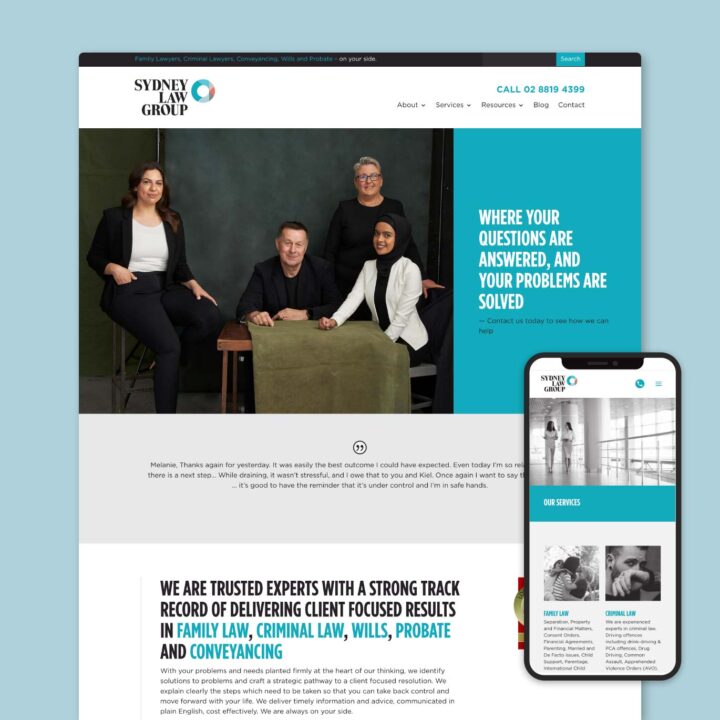
Locate an element on the screen. table is located at coordinates (235, 340).